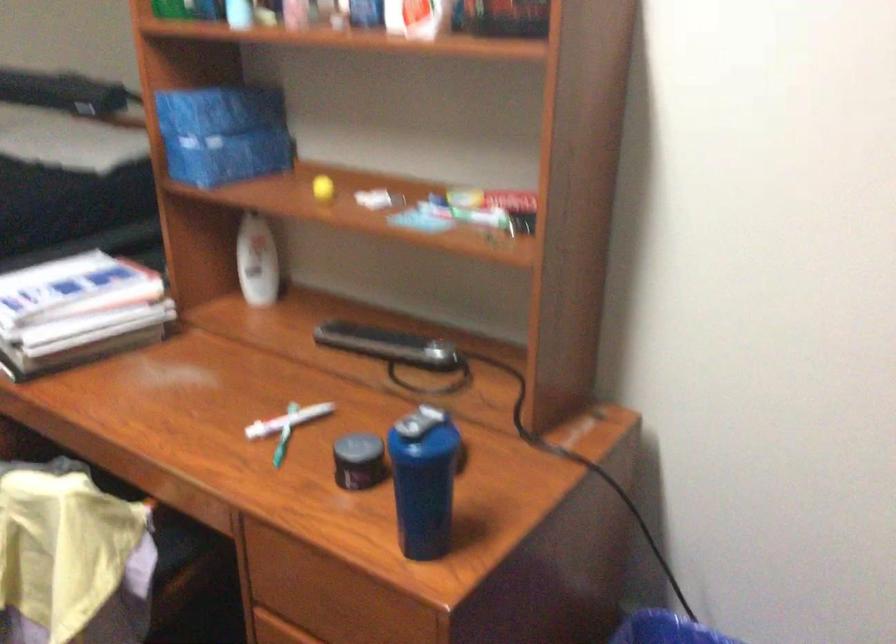
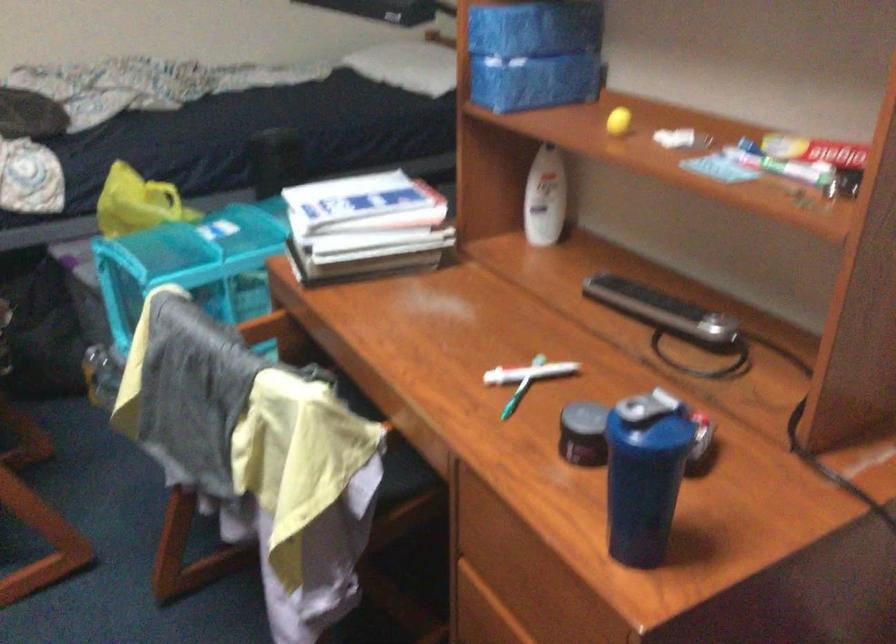
Locate, in the second image, the point that corresponds to [256,260] in the first image.

(545, 198)